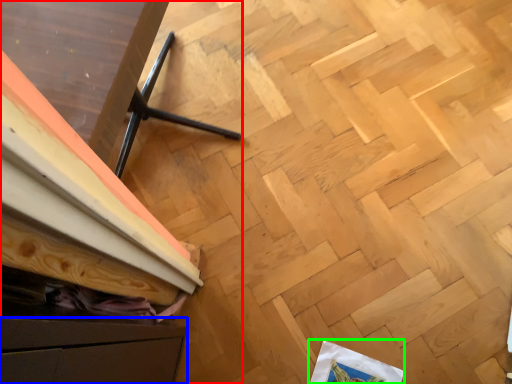
Question: Based on their relative distances, which object is farther from furniture (highlighted by a red box)? Choose from drawer (highlighted by a blue box) and wrapping paper (highlighted by a green box).

Choices:
 (A) drawer
 (B) wrapping paper

Answer: (B)